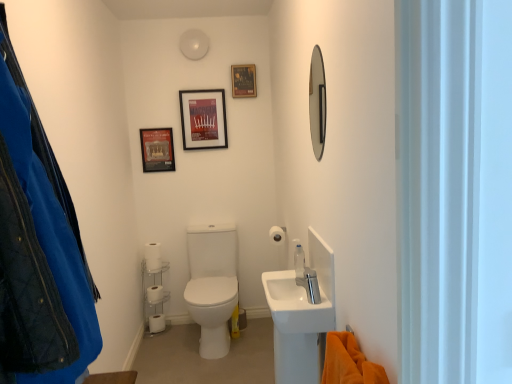
Question: Considering the positions of matte plastic picture frame at upper center, placed as the 2th picture frame when sorted from right to left, and shiny silver mirror at upper right in the image, is matte plastic picture frame at upper center, placed as the 2th picture frame when sorted from right to left, wider or thinner than shiny silver mirror at upper right?

Choices:
 (A) thin
 (B) wide

Answer: (B)

Question: In terms of height, does matte plastic picture frame at upper center, placed as the 2th picture frame when sorted from right to left, look taller or shorter compared to shiny silver mirror at upper right?

Choices:
 (A) tall
 (B) short

Answer: (B)

Question: Which object is positioned closest to the white matte toilet paper at lower left, marked as the second toilet paper in a back-to-front arrangement?

Choices:
 (A) matte plastic picture frame at upper center, placed as the 2th picture frame when sorted from right to left
 (B) white matte toilet paper at lower left, positioned as the second toilet paper in left-to-right order
 (C) satin nickel faucet at sink right
 (D) white matte toilet paper at lower left, the first toilet paper in the back-to-front sequence
 (E) white matte toilet paper at center, positioned as the 1th toilet paper in front-to-back order

Answer: (D)

Question: Which object is the closest to the satin nickel faucet at sink right?

Choices:
 (A) matte plastic picture frame at upper center, placed as the 2th picture frame when sorted from right to left
 (B) white matte toilet paper at lower left, positioned as the 4th toilet paper in front-to-back order
 (C) matte black picture frame at upper left, placed as the 3th picture frame when sorted from right to left
 (D) white plastic shelf at lower left
 (E) clear plastic soap dispenser at upper center

Answer: (E)